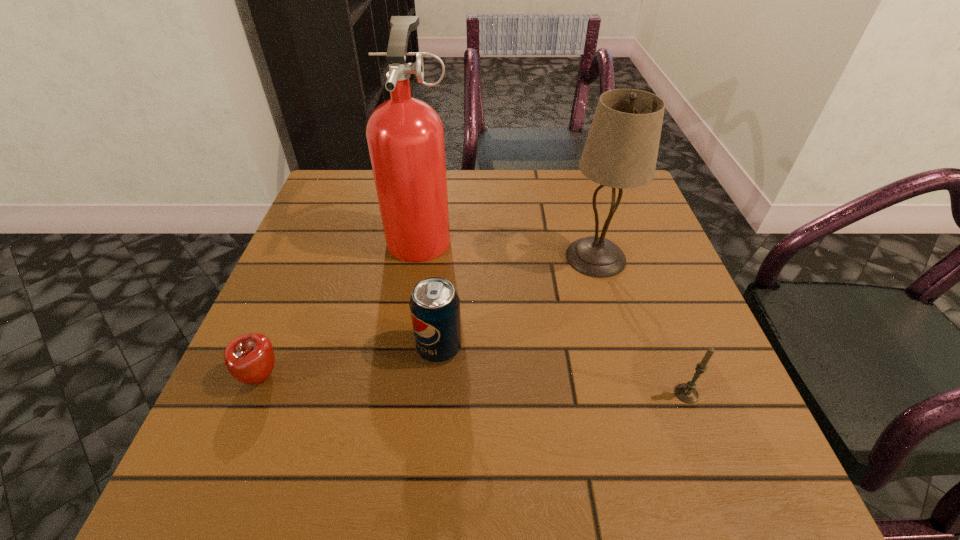
This screenshot has height=540, width=960. Identify the location of free point located on the front of the third tallest object. (428, 477).

This screenshot has height=540, width=960. I want to click on vacant space situated 0.290m on the left of the second shortest object, so click(x=502, y=394).

This screenshot has width=960, height=540. Identify the location of free space located 0.090m on the right of the apple. (334, 376).

The image size is (960, 540). Identify the location of object situated at the far edge. (405, 136).

You are a GUI agent. You are given a task and a screenshot of the screen. Output one action in this format:
    pyautogui.click(x=<x>, y=<y>)
    Task: Click on the object present at the left edge
    
    Given the screenshot: What is the action you would take?
    pyautogui.click(x=249, y=358)

Image resolution: width=960 pixels, height=540 pixels. Identify the location of lampshade positioned at the right edge. (621, 150).

Image resolution: width=960 pixels, height=540 pixels. I want to click on candle located in the right edge section of the desktop, so click(686, 392).

You are a GUI agent. You are given a task and a screenshot of the screen. Output one action in this format:
    pyautogui.click(x=<x>, y=<y>)
    Task: Click on the vacant region at the far edge of the desktop
    The height and width of the screenshot is (540, 960).
    Given the screenshot: What is the action you would take?
    pyautogui.click(x=528, y=176)

In the image, there is a desktop. At what (x,y) coordinates should I click in order to perform the action: click on free region at the near edge. Please return your answer as a coordinate pair (x, y). This screenshot has width=960, height=540. Looking at the image, I should click on (516, 451).

Locate an element on the screen. The image size is (960, 540). vacant space at the left edge of the desktop is located at coordinates (313, 226).